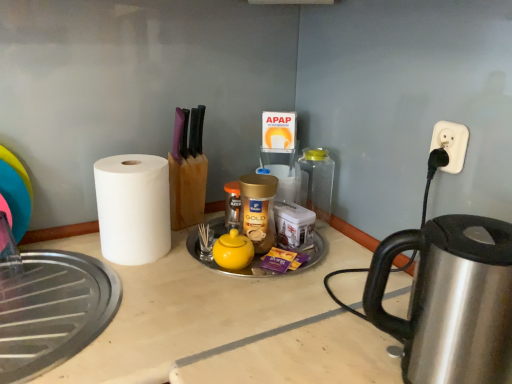
Question: Can you confirm if transparent glass jar at center is shorter than yellow matte tea pot at center?

Choices:
 (A) no
 (B) yes

Answer: (A)

Question: Can you confirm if transparent glass jar at center is thinner than yellow matte tea pot at center?

Choices:
 (A) no
 (B) yes

Answer: (B)

Question: Is there a large distance between transparent glass jar at center and yellow matte tea pot at center?

Choices:
 (A) no
 (B) yes

Answer: (A)

Question: Is transparent glass jar at center facing towards yellow matte tea pot at center?

Choices:
 (A) yes
 (B) no

Answer: (B)

Question: From a real-world perspective, does transparent glass jar at center sit lower than yellow matte tea pot at center?

Choices:
 (A) no
 (B) yes

Answer: (A)

Question: Could yellow matte tea pot at center be considered to be inside transparent glass jar at center?

Choices:
 (A) no
 (B) yes

Answer: (A)

Question: Considering the relative sizes of yellow matte tea pot at center and white plastic outlet at upper right in the image provided, is yellow matte tea pot at center smaller than white plastic outlet at upper right?

Choices:
 (A) no
 (B) yes

Answer: (A)

Question: Is yellow matte tea pot at center located outside white plastic outlet at upper right?

Choices:
 (A) yes
 (B) no

Answer: (A)

Question: Is white plastic outlet at upper right a part of yellow matte tea pot at center?

Choices:
 (A) yes
 (B) no

Answer: (B)

Question: Can you see yellow matte tea pot at center touching white plastic outlet at upper right?

Choices:
 (A) yes
 (B) no

Answer: (B)

Question: Is yellow matte tea pot at center positioned before white plastic outlet at upper right?

Choices:
 (A) no
 (B) yes

Answer: (A)

Question: Can you confirm if yellow matte tea pot at center is thinner than white plastic outlet at upper right?

Choices:
 (A) yes
 (B) no

Answer: (B)

Question: Can you confirm if satin silver kettle at right is bigger than white plastic outlet at upper right?

Choices:
 (A) no
 (B) yes

Answer: (B)